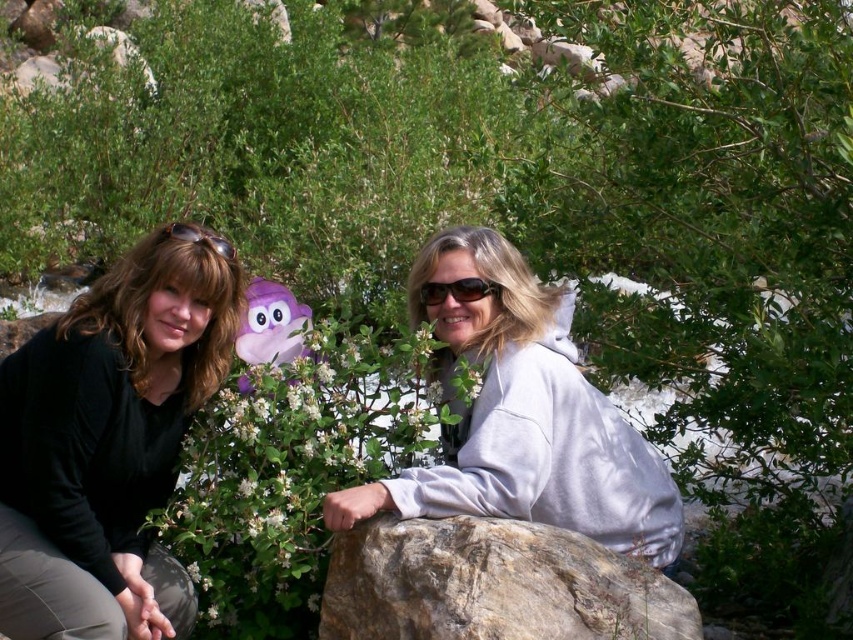
Is white fleece jacket at center thinner than purple plush toy at center?

No, white fleece jacket at center is not thinner than purple plush toy at center.

Does point (628, 490) come closer to viewer compared to point (281, 289)?

Yes, point (628, 490) is in front of point (281, 289).

This screenshot has height=640, width=853. Describe the element at coordinates (523, 417) in the screenshot. I see `white fleece jacket at center` at that location.

Find the location of a particular element. white fleece jacket at center is located at coordinates (523, 417).

From the picture: Does rocky gray boulder at center come in front of matte black sunglasses at upper left?

Yes, rocky gray boulder at center is in front of matte black sunglasses at upper left.

Is rocky gray boulder at center to the right of matte black sunglasses at upper left from the viewer's perspective?

Correct, you'll find rocky gray boulder at center to the right of matte black sunglasses at upper left.

Is point (364, 540) positioned in front of point (212, 246)?

Yes, point (364, 540) is in front of point (212, 246).

Identify the location of rocky gray boulder at center. The width and height of the screenshot is (853, 640). click(492, 584).

Is point (469, 611) less distant than point (485, 289)?

Yes.

The width and height of the screenshot is (853, 640). What do you see at coordinates (492, 584) in the screenshot? I see `rocky gray boulder at center` at bounding box center [492, 584].

Where is `rocky gray boulder at center`? rocky gray boulder at center is located at coordinates (492, 584).